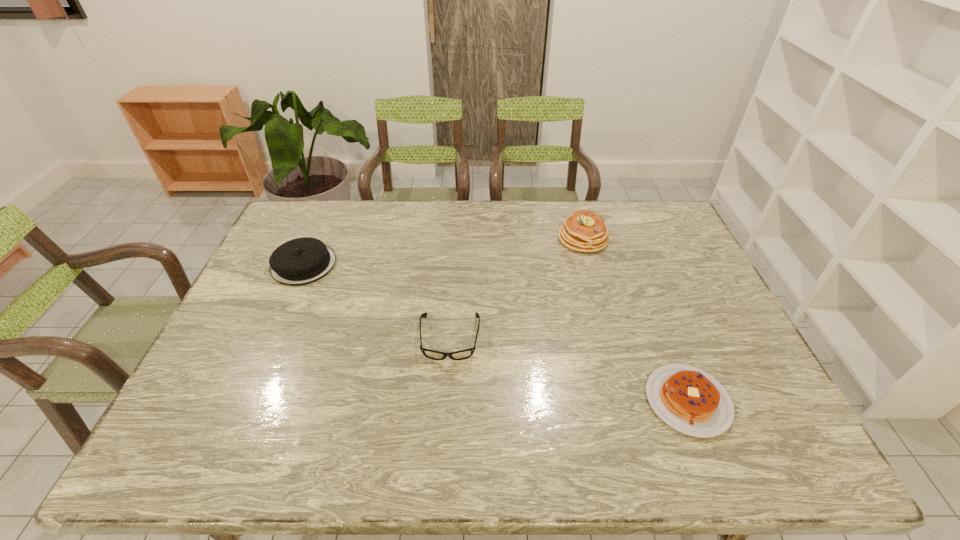
The width and height of the screenshot is (960, 540). What are the coordinates of `the tallest pancake` in the screenshot? It's located at (585, 231).

Locate an element on the screen. the leftmost object is located at coordinates (300, 261).

Image resolution: width=960 pixels, height=540 pixels. Find the location of `the leftmost pancake`. the leftmost pancake is located at coordinates (300, 261).

The width and height of the screenshot is (960, 540). I want to click on spectacles, so click(x=467, y=353).

Where is `the third object from right to left`? Image resolution: width=960 pixels, height=540 pixels. the third object from right to left is located at coordinates (467, 353).

You are a GUI agent. You are given a task and a screenshot of the screen. Output one action in this format:
    pyautogui.click(x=<x>, y=<y>)
    Task: Click on the shortest object
    The height and width of the screenshot is (540, 960).
    Given the screenshot: What is the action you would take?
    pyautogui.click(x=691, y=401)

Identify the location of the shortest pancake. (691, 401).

You are a GUI agent. You are given a task and a screenshot of the screen. Output one action in this format:
    pyautogui.click(x=<x>, y=<y>)
    Task: Click on the free space located 0.150m on the front of the tallest object
    The image size is (960, 540).
    Given the screenshot: What is the action you would take?
    pyautogui.click(x=596, y=286)

Where is `blank space located on the right of the leftmost object`? The height and width of the screenshot is (540, 960). blank space located on the right of the leftmost object is located at coordinates (400, 264).

The image size is (960, 540). What are the coordinates of `vacant space situated 0.140m on the front-facing side of the third farthest object` in the screenshot? It's located at (445, 413).